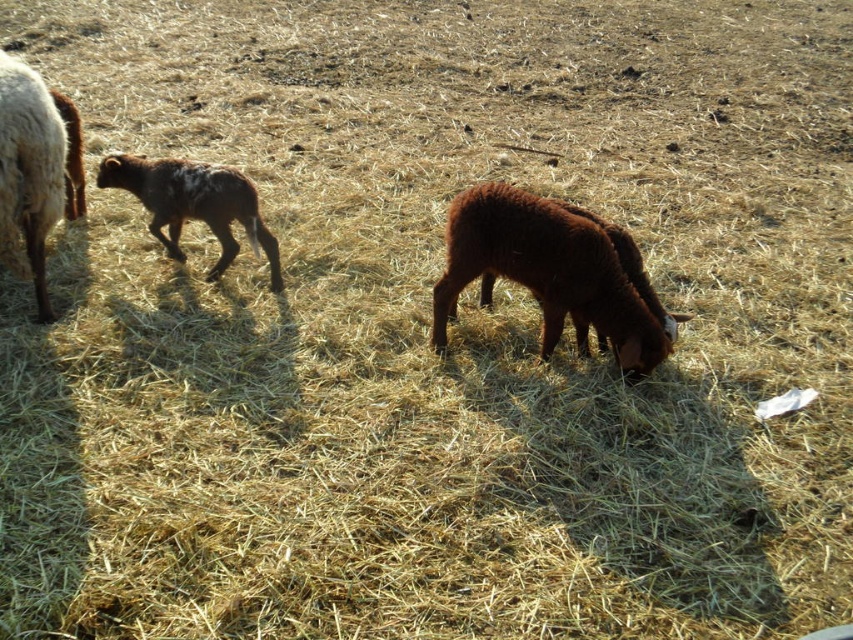
Is brown woolen lamb at center wider than white woolen sheep at left?

Indeed, brown woolen lamb at center has a greater width compared to white woolen sheep at left.

Is brown woolen lamb at center closer to the viewer compared to white woolen sheep at left?

No.

Between point (508, 228) and point (49, 209), which one is positioned behind?

The point (49, 209) is more distant.

The width and height of the screenshot is (853, 640). I want to click on brown woolen lamb at center, so click(x=546, y=273).

Does brown woolen lamb at center appear on the right side of speckled brown lamb at left?

Yes, brown woolen lamb at center is to the right of speckled brown lamb at left.

Measure the distance between brown woolen lamb at center and speckled brown lamb at left.

They are 1.21 meters apart.

Is point (450, 227) more distant than point (151, 195)?

No, (450, 227) is in front of (151, 195).

Locate an element on the screen. brown woolen lamb at center is located at coordinates (546, 273).

Which is more to the right, white woolen sheep at left or speckled brown lamb at left?

Positioned to the right is speckled brown lamb at left.

Between white woolen sheep at left and speckled brown lamb at left, which one appears on the left side from the viewer's perspective?

Positioned to the left is white woolen sheep at left.

Identify the location of white woolen sheep at left. (28, 172).